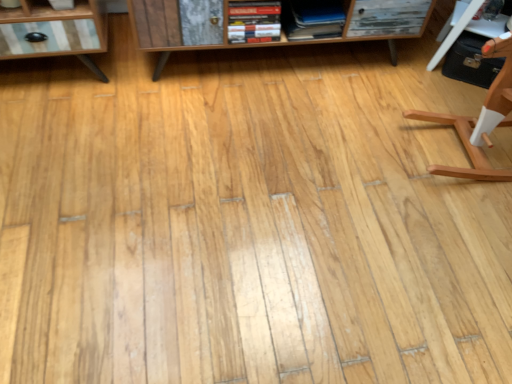
You are a GUI agent. You are given a task and a screenshot of the screen. Output one action in this format:
    pyautogui.click(x=<x>, y=<y>)
    Task: Click on the free spot in front of light brown wood rocking chair at right
    The height and width of the screenshot is (384, 512).
    Given the screenshot: What is the action you would take?
    pyautogui.click(x=453, y=238)